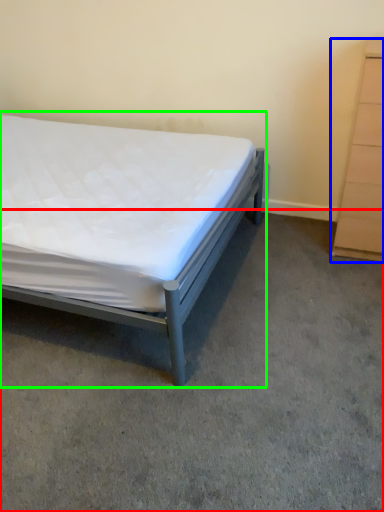
Question: Which is farther away from concrete (highlighted by a red box)? chest of drawers (highlighted by a blue box) or bed (highlighted by a green box)?

Choices:
 (A) chest of drawers
 (B) bed

Answer: (A)